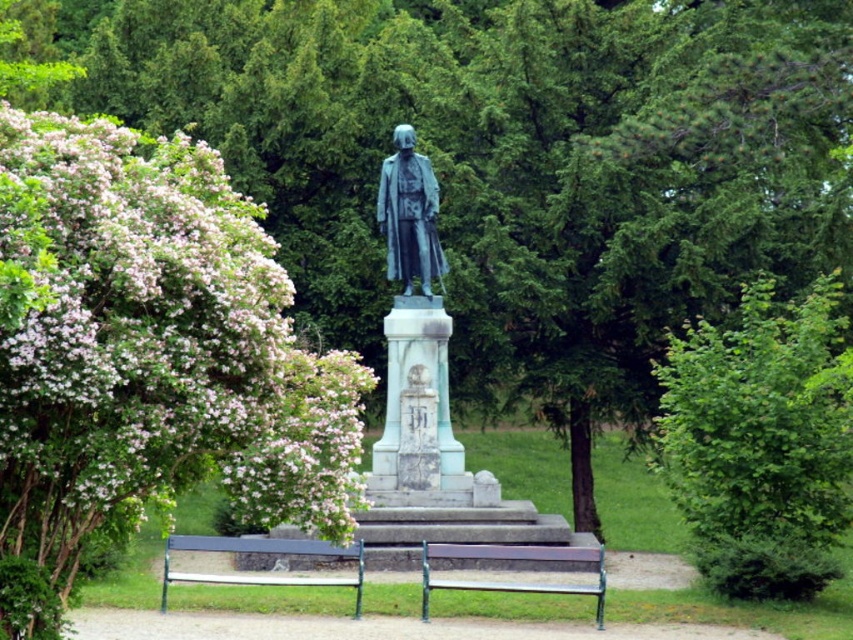
Looking at this image, you are planning to sit on one of the benches in the park. The metallic green bench at center and wooden bench at center are both available. Which bench would you choose if you want to sit closer to the statue?

The metallic green bench at center and wooden bench at center are both located at the center, so they are equidistant from the statue. Therefore, neither is closer than the other.

You are planning to host a small gathering in the park and need seating for 10 people. You see the metallic green bench at center and the wooden bench at center. Which bench can accommodate more people?

The metallic green bench at center has a larger size compared to wooden bench at center, so it can accommodate more people.